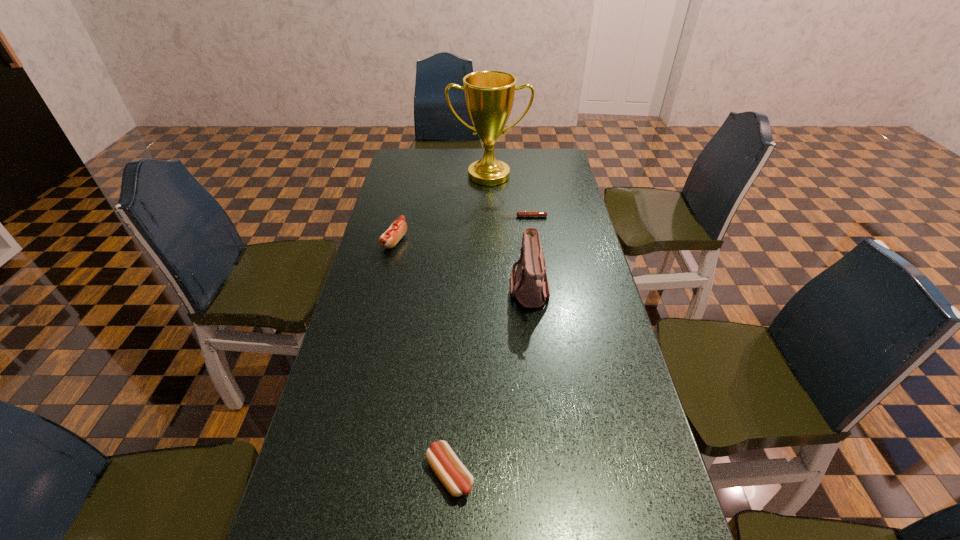
At what (x,y) coordinates should I click in order to perform the action: click on award. Please return your answer as a coordinate pair (x, y). Looking at the image, I should click on (489, 95).

Where is `the tallest object`? the tallest object is located at coordinates (489, 95).

Find the location of a particular element. the second tallest object is located at coordinates (529, 284).

Where is `the fourth farthest object`? This screenshot has height=540, width=960. the fourth farthest object is located at coordinates (529, 284).

You are a GUI agent. You are given a task and a screenshot of the screen. Output one action in this format:
    pyautogui.click(x=<x>, y=<y>)
    Task: Click on the third tallest object
    
    Given the screenshot: What is the action you would take?
    pyautogui.click(x=389, y=239)

Where is `the leftmost sausage`? The height and width of the screenshot is (540, 960). the leftmost sausage is located at coordinates (389, 239).

Find the location of a particular element. the second shortest object is located at coordinates 451,472.

At what (x,y) coordinates should I click in order to perform the action: click on the nearest sausage. Please return your answer as a coordinate pair (x, y). The height and width of the screenshot is (540, 960). Looking at the image, I should click on [451, 472].

You are a GUI agent. You are given a task and a screenshot of the screen. Output one action in this format:
    pyautogui.click(x=<x>, y=<y>)
    Task: Click on the rightmost sausage
    
    Given the screenshot: What is the action you would take?
    pyautogui.click(x=521, y=213)

What are the coordinates of `the shortest object` in the screenshot? It's located at (521, 213).